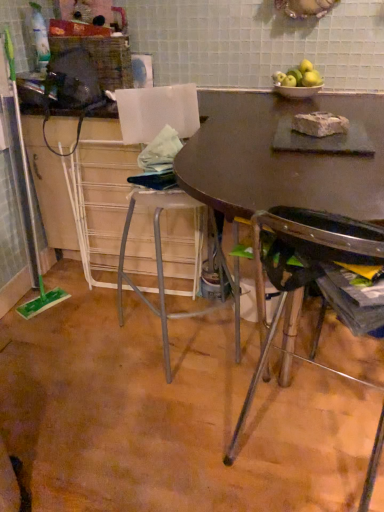
Question: Should I look upward or downward to see matte brown table at center?

Choices:
 (A) up
 (B) down

Answer: (B)

Question: From a real-world perspective, does matte brown table at center stand above matte brown table at upper center?

Choices:
 (A) no
 (B) yes

Answer: (B)

Question: Can you confirm if matte brown table at center is wider than matte brown table at upper center?

Choices:
 (A) no
 (B) yes

Answer: (B)

Question: Could matte brown table at upper center be considered to be inside matte brown table at center?

Choices:
 (A) no
 (B) yes

Answer: (A)

Question: Considering the relative sizes of matte brown table at center and matte brown table at upper center in the image provided, is matte brown table at center taller than matte brown table at upper center?

Choices:
 (A) yes
 (B) no

Answer: (B)

Question: Is matte brown table at center outside matte brown table at upper center?

Choices:
 (A) no
 (B) yes

Answer: (B)

Question: From the image's perspective, is matte brown table at center beneath matte brown table at upper center?

Choices:
 (A) yes
 (B) no

Answer: (A)

Question: Is metallic silver chair at lower right oriented towards green matte apples at upper right?

Choices:
 (A) yes
 (B) no

Answer: (B)

Question: From the image's perspective, would you say metallic silver chair at lower right is shown under green matte apples at upper right?

Choices:
 (A) no
 (B) yes

Answer: (B)

Question: Is green matte apples at upper right inside metallic silver chair at lower right?

Choices:
 (A) no
 (B) yes

Answer: (A)

Question: Is metallic silver chair at lower right at the right side of green matte apples at upper right?

Choices:
 (A) no
 (B) yes

Answer: (A)

Question: Can you confirm if metallic silver chair at lower right is smaller than green matte apples at upper right?

Choices:
 (A) no
 (B) yes

Answer: (A)

Question: Would you say metallic silver chair at lower right is a long distance from green matte apples at upper right?

Choices:
 (A) yes
 (B) no

Answer: (A)

Question: Would you say matte brown table at upper center is outside metallic silver chair at lower right?

Choices:
 (A) no
 (B) yes

Answer: (B)